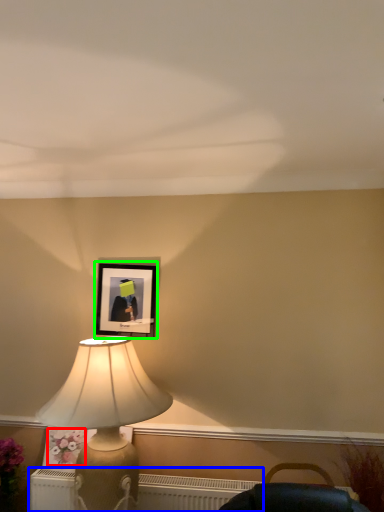
Question: Which object is positioned farthest from flower (highlighted by a red box)? Select from radiator (highlighted by a blue box) and picture frame (highlighted by a green box).

Choices:
 (A) radiator
 (B) picture frame

Answer: (B)